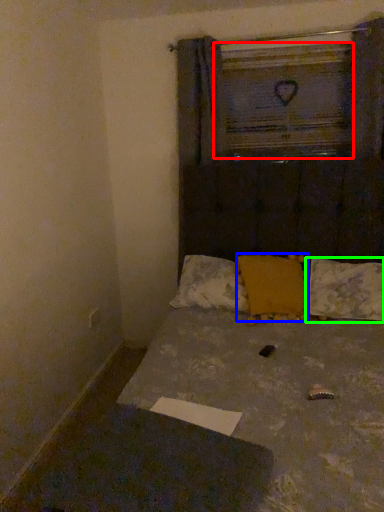
Question: Estimate the real-world distances between objects in this image. Which object is farther from window frame (highlighted by a red box), pillow (highlighted by a blue box) or pillow (highlighted by a green box)?

Choices:
 (A) pillow
 (B) pillow

Answer: (B)